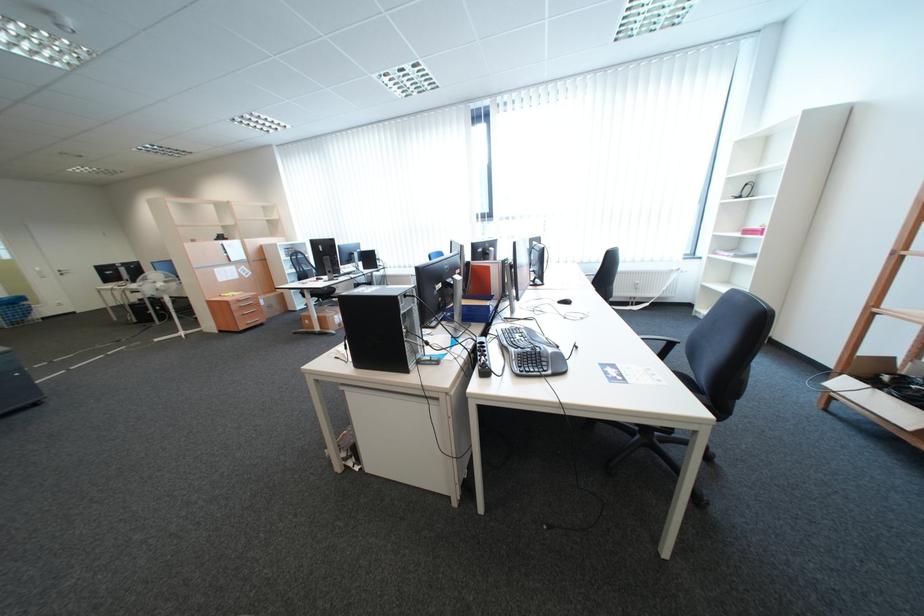
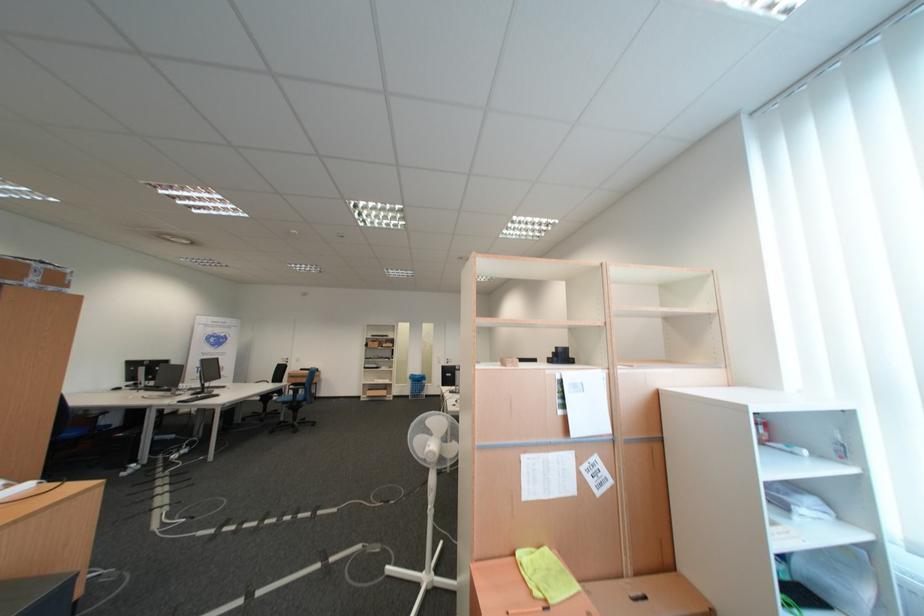
The point at [234,297] is marked in the first image. Where is the corresponding point in the second image?

(526, 556)